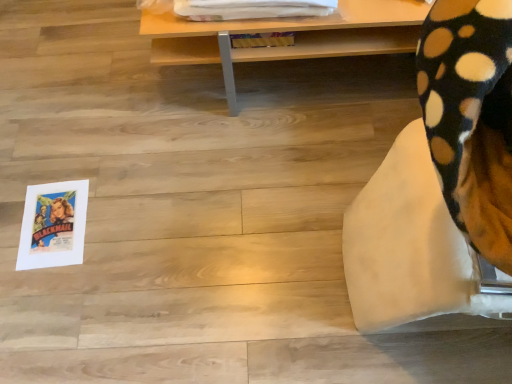
Question: From the image's perspective, is wooden table at upper center above or below soft fleece blanket at lower right?

Choices:
 (A) below
 (B) above

Answer: (B)

Question: Is wooden table at upper center wider or thinner than soft fleece blanket at lower right?

Choices:
 (A) thin
 (B) wide

Answer: (B)

Question: From a real-world perspective, is wooden table at upper center above or below soft fleece blanket at lower right?

Choices:
 (A) below
 (B) above

Answer: (A)

Question: From a real-world perspective, relative to wooden table at upper center, is soft fleece blanket at lower right vertically above or below?

Choices:
 (A) below
 (B) above

Answer: (B)

Question: Is soft fleece blanket at lower right bigger or smaller than wooden table at upper center?

Choices:
 (A) small
 (B) big

Answer: (B)

Question: From their relative heights in the image, would you say soft fleece blanket at lower right is taller or shorter than wooden table at upper center?

Choices:
 (A) tall
 (B) short

Answer: (A)

Question: In terms of width, does soft fleece blanket at lower right look wider or thinner when compared to wooden table at upper center?

Choices:
 (A) wide
 (B) thin

Answer: (B)